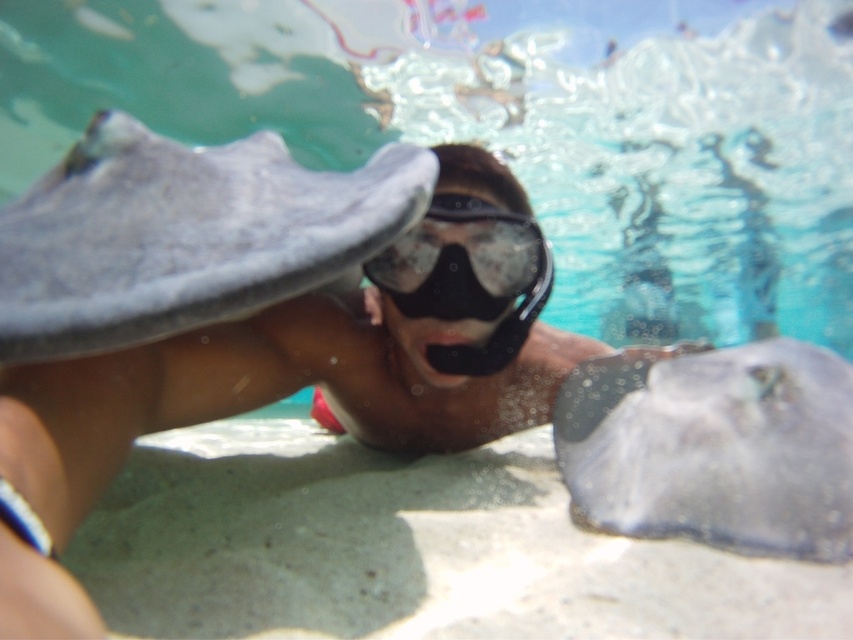
You are a marine biologist observing an underwater scene. You notice a point at coordinate (297,376). What object is located at that point?

The matte gray diver at center is located at point (297,376).

You are a marine biologist observing an underwater scene. You notice a matte gray diver at center and a translucent rubber stingray at center. Based on their positions, can the diver safely interact with the stingray without causing harm?

The matte gray diver at center is 50.95 centimeters away from the translucent rubber stingray at center. Since this distance allows for safe interaction without disturbing the stingray, the diver can safely interact with it.

You are a photographer trying to capture the perfect shot of the two points in the underwater scene. Which point, point (366, 244) or point (822, 456), would appear larger in your camera frame?

Point (366, 244) appears larger because it is closer to the camera than point (822, 456).